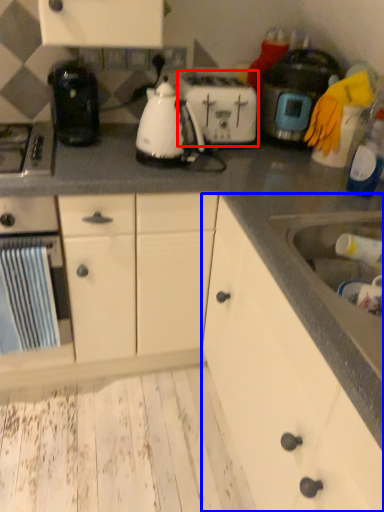
Question: Which point is closer to the camera, toaster (highlighted by a red box) or cabinetry (highlighted by a blue box)?

Choices:
 (A) toaster
 (B) cabinetry

Answer: (B)